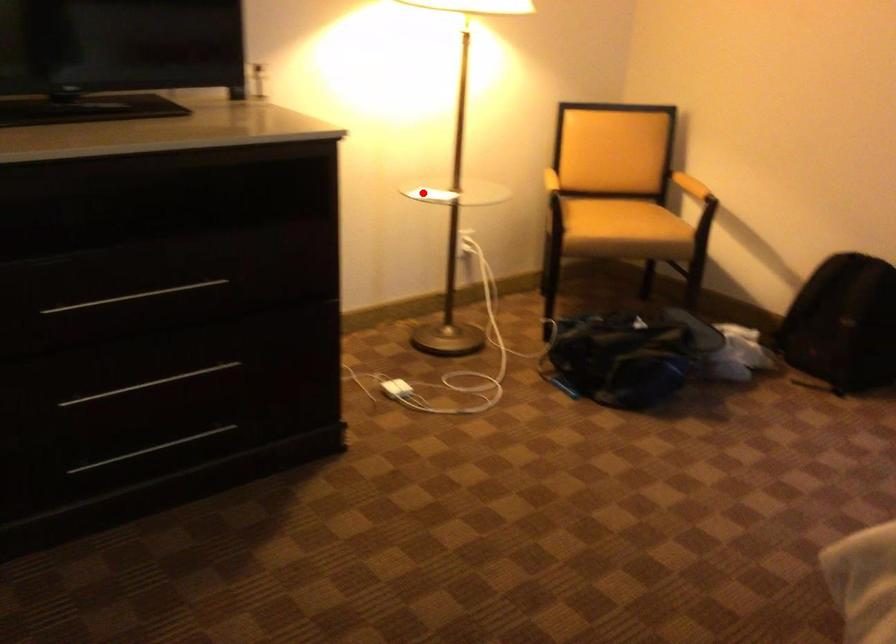
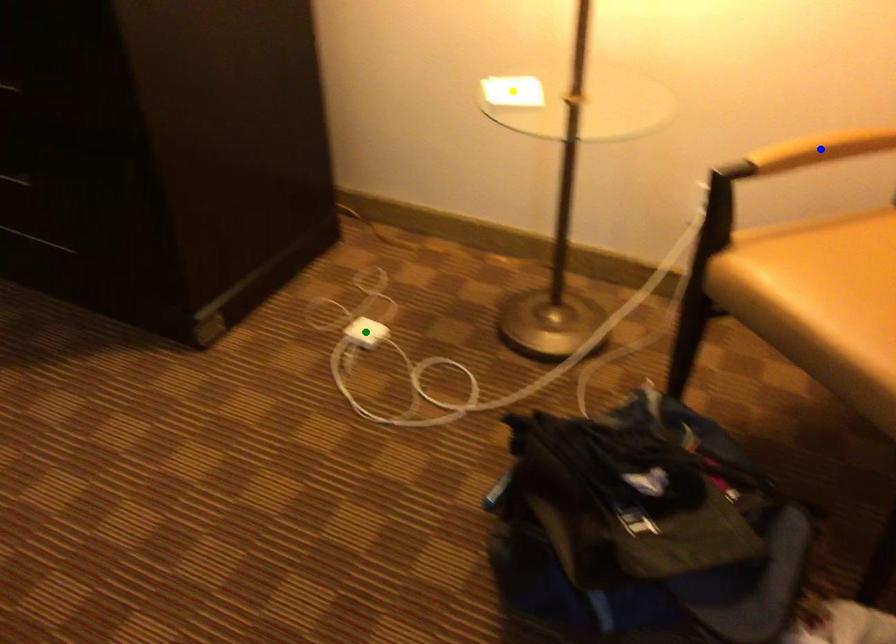
Question: I am providing you with two images of the same scene from different viewpoints. A red point is marked on the first image. You are given multiple points on the second image. In image 2, which mark is for the same physical point as the one in image 1?

Choices:
 (A) blue point
 (B) yellow point
 (C) green point

Answer: (B)